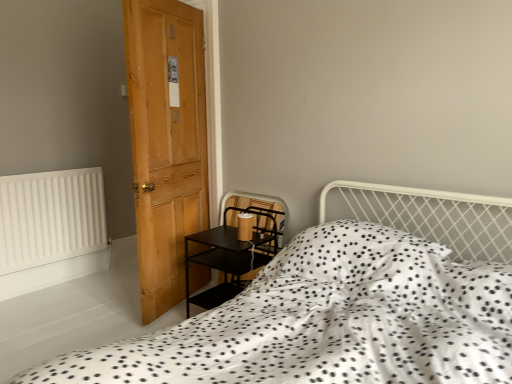
Describe the element at coordinates (167, 145) in the screenshot. The image size is (512, 384). I see `light brown wooden door at left` at that location.

Image resolution: width=512 pixels, height=384 pixels. Find the location of `black matte side table at lower left`. black matte side table at lower left is located at coordinates (226, 261).

Based on the photo, does white matte radiator at left have a greater height compared to light brown wooden door at left?

No.

Between white matte radiator at left and light brown wooden door at left, which one appears on the right side from the viewer's perspective?

light brown wooden door at left is more to the right.

Which is behind, white dotted fabric at center or light brown wooden door at left?

light brown wooden door at left.

Find the location of a particular element. door lying on the left of white dotted fabric at center is located at coordinates (167, 145).

Considering the sizes of objects white dotted fabric at center and light brown wooden door at left in the image provided, who is wider, white dotted fabric at center or light brown wooden door at left?

Wider between the two is white dotted fabric at center.

Is there a large distance between white dotted fabric at center and light brown wooden door at left?

white dotted fabric at center is positioned a significant distance from light brown wooden door at left.

Image resolution: width=512 pixels, height=384 pixels. I want to click on table that appears on the left of white dotted fabric at center, so click(226, 261).

Is point (355, 269) in front of point (271, 237)?

Yes, point (355, 269) is closer to viewer.

Based on the photo, is white dotted fabric at center looking in the opposite direction of black matte side table at lower left?

No, white dotted fabric at center is not facing away from black matte side table at lower left.

From the image's perspective, relative to black matte side table at lower left, is white dotted fabric at center above or below?

Based on their image positions, white dotted fabric at center is located beneath black matte side table at lower left.

Is black matte side table at lower left looking in the opposite direction of white dotted fabric at center?

No, black matte side table at lower left is not facing away from white dotted fabric at center.

Between black matte side table at lower left and white dotted fabric at center, which one has smaller size?

black matte side table at lower left is smaller.

Looking at this image, is black matte side table at lower left to the right of white dotted fabric at center from the viewer's perspective?

Incorrect, black matte side table at lower left is not on the right side of white dotted fabric at center.

From a real-world perspective, is light brown wooden door at left positioned above or below black matte side table at lower left?

From a real-world perspective, light brown wooden door at left is physically above black matte side table at lower left.

From the image's perspective, which one is positioned higher, light brown wooden door at left or black matte side table at lower left?

light brown wooden door at left appears higher in the image.

Considering their positions, is light brown wooden door at left located in front of or behind black matte side table at lower left?

Visually, light brown wooden door at left is located in front of black matte side table at lower left.

Which is closer, (151, 109) or (255, 243)?

The point (151, 109) is closer to the camera.

Between light brown wooden door at left and white dotted fabric at center, which one is positioned behind?

light brown wooden door at left is further away from the camera.

Is light brown wooden door at left bigger or smaller than white dotted fabric at center?

light brown wooden door at left is smaller than white dotted fabric at center.

Is light brown wooden door at left positioned far away from white dotted fabric at center?

Yes.

Between light brown wooden door at left and white dotted fabric at center, which one appears on the left side from the viewer's perspective?

From the viewer's perspective, light brown wooden door at left appears more on the left side.

Is white dotted fabric at center inside the boundaries of white matte radiator at left, or outside?

white dotted fabric at center is outside white matte radiator at left.

How many degrees apart are the facing directions of white dotted fabric at center and white matte radiator at left?

white dotted fabric at center and white matte radiator at left are facing 91 degrees away from each other.

Does white dotted fabric at center appear on the left side of white matte radiator at left?

In fact, white dotted fabric at center is to the right of white matte radiator at left.

Based on the photo, considering the sizes of white dotted fabric at center and white matte radiator at left in the image, is white dotted fabric at center taller or shorter than white matte radiator at left?

Considering their sizes, white dotted fabric at center has less height than white matte radiator at left.

Find the location of `door that is above the white matte radiator at left (from a real-world perspective)`. door that is above the white matte radiator at left (from a real-world perspective) is located at coordinates (167, 145).

Locate an element on the screen. The height and width of the screenshot is (384, 512). door that appears above the white dotted fabric at center (from the image's perspective) is located at coordinates (167, 145).

Estimate the real-world distances between objects in this image. Which object is further from white matte radiator at left, light brown wooden door at left or black matte side table at lower left?

Among the two, black matte side table at lower left is located further to white matte radiator at left.

Looking at the image, which one is located closer to white matte radiator at left, white dotted fabric at center or light brown wooden door at left?

The object closer to white matte radiator at left is light brown wooden door at left.

From the image, which object appears to be nearer to black matte side table at lower left, light brown wooden door at left or white dotted fabric at center?

light brown wooden door at left is positioned closer to the anchor black matte side table at lower left.

When comparing their distances from white matte radiator at left, does light brown wooden door at left or white dotted fabric at center seem further?

Based on the image, white dotted fabric at center appears to be further to white matte radiator at left.

From the picture: When comparing their distances from black matte side table at lower left, does white dotted fabric at center or white matte radiator at left seem closer?

white dotted fabric at center is positioned closer to the anchor black matte side table at lower left.

Which object lies nearer to the anchor point white dotted fabric at center, black matte side table at lower left or light brown wooden door at left?

Based on the image, black matte side table at lower left appears to be nearer to white dotted fabric at center.

When comparing their distances from white dotted fabric at center, does light brown wooden door at left or black matte side table at lower left seem further?

Based on the image, light brown wooden door at left appears to be further to white dotted fabric at center.

From the image, which object appears to be nearer to light brown wooden door at left, black matte side table at lower left or white dotted fabric at center?

black matte side table at lower left is closer to light brown wooden door at left.

What are the coordinates of `door between white dotted fabric at center and black matte side table at lower left along the z-axis` in the screenshot? It's located at (167, 145).

At what (x,y) coordinates should I click in order to perform the action: click on table between white dotted fabric at center and white matte radiator at left from front to back. Please return your answer as a coordinate pair (x, y). The height and width of the screenshot is (384, 512). Looking at the image, I should click on (226, 261).

Locate an element on the screen. The height and width of the screenshot is (384, 512). door positioned between white dotted fabric at center and white matte radiator at left from near to far is located at coordinates (167, 145).

Locate an element on the screen. door between white matte radiator at left and black matte side table at lower left from left to right is located at coordinates (167, 145).